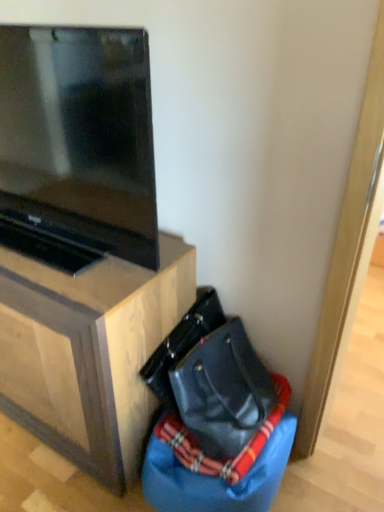
Question: Can you confirm if matte black tv at upper left is smaller than blue fabric bean bag chair at lower right?

Choices:
 (A) yes
 (B) no

Answer: (B)

Question: Is matte black tv at upper left not inside blue fabric bean bag chair at lower right?

Choices:
 (A) no
 (B) yes

Answer: (B)

Question: Considering the relative sizes of matte black tv at upper left and blue fabric bean bag chair at lower right in the image provided, is matte black tv at upper left shorter than blue fabric bean bag chair at lower right?

Choices:
 (A) yes
 (B) no

Answer: (B)

Question: From the image's perspective, is matte black tv at upper left under blue fabric bean bag chair at lower right?

Choices:
 (A) yes
 (B) no

Answer: (B)

Question: Is matte black tv at upper left with blue fabric bean bag chair at lower right?

Choices:
 (A) yes
 (B) no

Answer: (B)

Question: From a real-world perspective, is matte black tv at upper left located beneath blue fabric bean bag chair at lower right?

Choices:
 (A) yes
 (B) no

Answer: (B)

Question: Does matte black tv at upper left come in front of black leather messenger bag at lower right?

Choices:
 (A) no
 (B) yes

Answer: (B)

Question: Can you confirm if matte black tv at upper left is wider than black leather messenger bag at lower right?

Choices:
 (A) no
 (B) yes

Answer: (B)

Question: Is matte black tv at upper left outside black leather messenger bag at lower right?

Choices:
 (A) no
 (B) yes

Answer: (B)

Question: Could black leather messenger bag at lower right be considered to be inside matte black tv at upper left?

Choices:
 (A) yes
 (B) no

Answer: (B)

Question: From a real-world perspective, is matte black tv at upper left on top of black leather messenger bag at lower right?

Choices:
 (A) no
 (B) yes

Answer: (B)

Question: Considering the relative sizes of matte black tv at upper left and black leather messenger bag at lower right in the image provided, is matte black tv at upper left smaller than black leather messenger bag at lower right?

Choices:
 (A) no
 (B) yes

Answer: (A)

Question: From a real-world perspective, is black leather messenger bag at lower right positioned over matte black tv at upper left based on gravity?

Choices:
 (A) yes
 (B) no

Answer: (B)